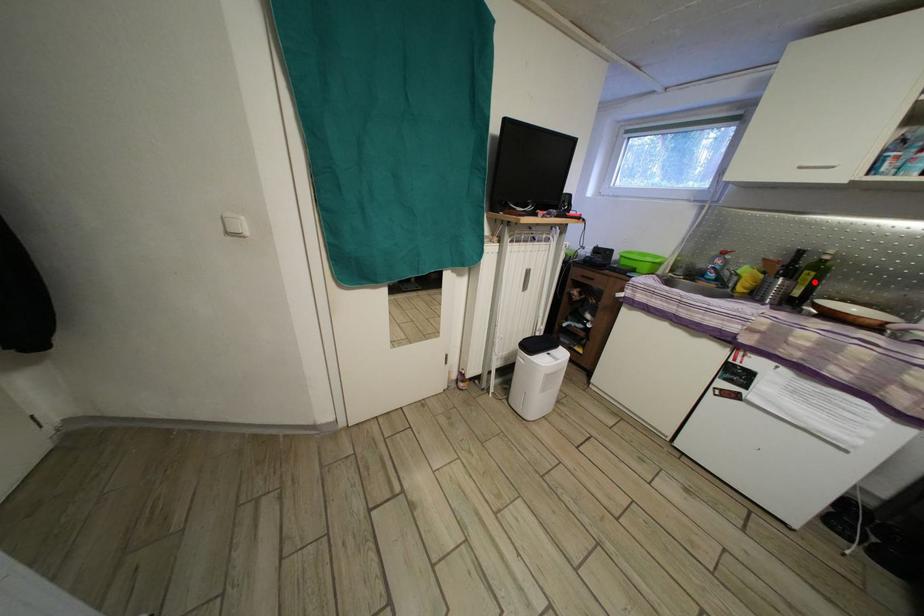
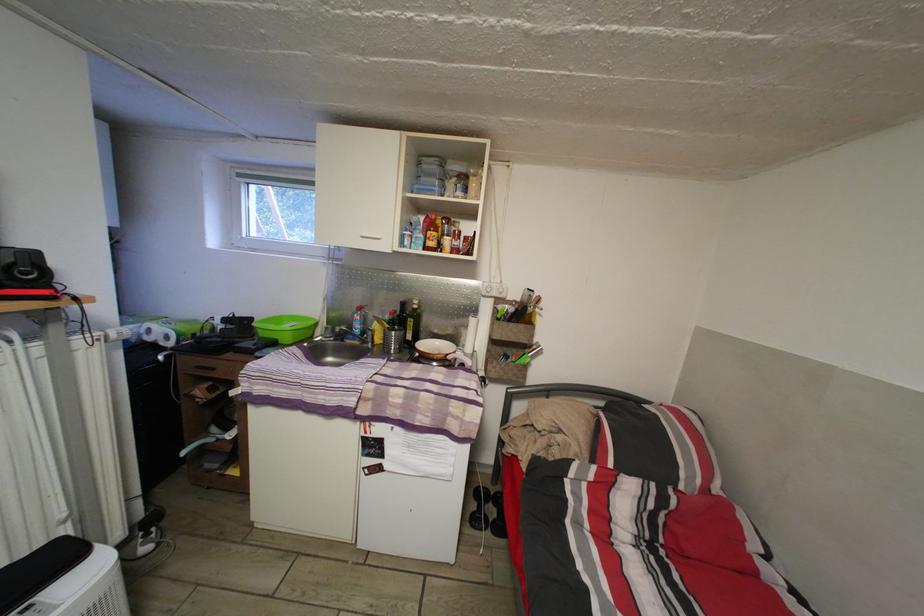
Where in the second image is the point corresponding to the highlighted location from the first image?

(418, 329)